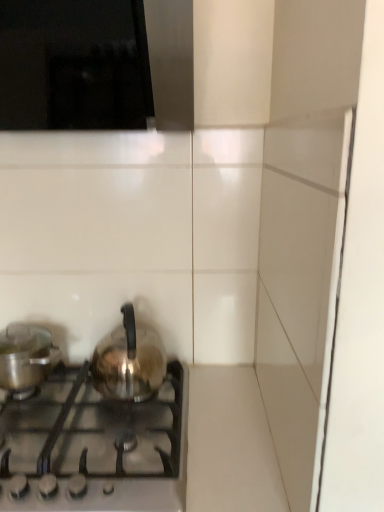
Question: Could you tell me if shiny metallic kettle at lower left is facing shiny metallic pot at left, the first kitchen appliance positioned from the left?

Choices:
 (A) no
 (B) yes

Answer: (A)

Question: Can you confirm if shiny metallic kettle at lower left is taller than shiny metallic pot at left, the 2th kitchen appliance from the right?

Choices:
 (A) no
 (B) yes

Answer: (A)

Question: Does shiny metallic kettle at lower left appear on the left side of shiny metallic pot at left, the 2th kitchen appliance from the right?

Choices:
 (A) no
 (B) yes

Answer: (A)

Question: From the image's perspective, does shiny metallic kettle at lower left appear higher than shiny metallic pot at left, the 2th kitchen appliance from the right?

Choices:
 (A) no
 (B) yes

Answer: (A)

Question: Can you confirm if shiny metallic kettle at lower left is shorter than shiny metallic pot at left, the first kitchen appliance positioned from the left?

Choices:
 (A) yes
 (B) no

Answer: (A)

Question: Visually, is shiny metallic pot at left, the 2th kitchen appliance from the right, positioned to the left or to the right of shiny metallic kettle at center, the 2th kitchen appliance when ordered from left to right?

Choices:
 (A) right
 (B) left

Answer: (B)

Question: Based on their sizes in the image, would you say shiny metallic pot at left, the 2th kitchen appliance from the right, is bigger or smaller than shiny metallic kettle at center, the 2th kitchen appliance when ordered from left to right?

Choices:
 (A) big
 (B) small

Answer: (B)

Question: In terms of height, does shiny metallic pot at left, the first kitchen appliance positioned from the left, look taller or shorter compared to shiny metallic kettle at center, the 2th kitchen appliance when ordered from left to right?

Choices:
 (A) short
 (B) tall

Answer: (A)

Question: Is shiny metallic pot at left, the 2th kitchen appliance from the right, in front of or behind shiny metallic kettle at center, the 2th kitchen appliance when ordered from left to right, in the image?

Choices:
 (A) behind
 (B) front

Answer: (A)

Question: From a real-world perspective, is shiny metallic pot at left, the first kitchen appliance positioned from the left, physically located above or below shiny metallic kettle at lower left?

Choices:
 (A) above
 (B) below

Answer: (A)

Question: In the image, is shiny metallic pot at left, the 2th kitchen appliance from the right, positioned in front of or behind shiny metallic kettle at lower left?

Choices:
 (A) behind
 (B) front

Answer: (A)

Question: In terms of width, does shiny metallic pot at left, the first kitchen appliance positioned from the left, look wider or thinner when compared to shiny metallic kettle at lower left?

Choices:
 (A) wide
 (B) thin

Answer: (B)

Question: From the image's perspective, is shiny metallic pot at left, the first kitchen appliance positioned from the left, located above or below shiny metallic kettle at lower left?

Choices:
 (A) below
 (B) above

Answer: (B)

Question: Based on their sizes in the image, would you say shiny metallic kettle at center, the 2th kitchen appliance when ordered from left to right, is bigger or smaller than shiny metallic kettle at lower left?

Choices:
 (A) small
 (B) big

Answer: (A)

Question: Does point (97, 362) appear closer or farther from the camera than point (66, 388)?

Choices:
 (A) farther
 (B) closer

Answer: (A)